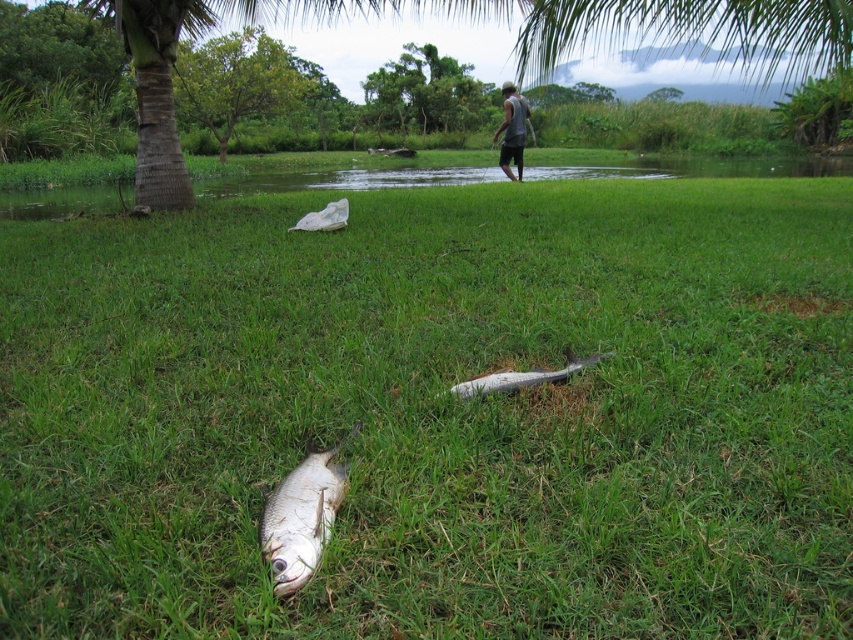
Between point (517, 380) and point (303, 221), which one is positioned behind?

The point (303, 221) is behind.

Between silver shiny fish at center and white plastic bag at center, which one appears on the right side from the viewer's perspective?

silver shiny fish at center is more to the right.

Identify the location of silver shiny fish at center. The width and height of the screenshot is (853, 640). (521, 376).

At what (x,y) coordinates should I click in order to perform the action: click on silver shiny fish at center. Please return your answer as a coordinate pair (x, y). This screenshot has width=853, height=640. Looking at the image, I should click on (521, 376).

Can you confirm if green grass at center is positioned to the right of shiny silver fish at lower center?

Correct, you'll find green grass at center to the right of shiny silver fish at lower center.

Is point (849, 257) closer to viewer compared to point (303, 515)?

No, (849, 257) is behind (303, 515).

The height and width of the screenshot is (640, 853). I want to click on green grass at center, so click(436, 413).

Between point (289, 502) and point (320, 218), which one is positioned in front?

Point (289, 502) is more forward.

This screenshot has width=853, height=640. What are the coordinates of `shiny silver fish at lower center` in the screenshot? It's located at (300, 518).